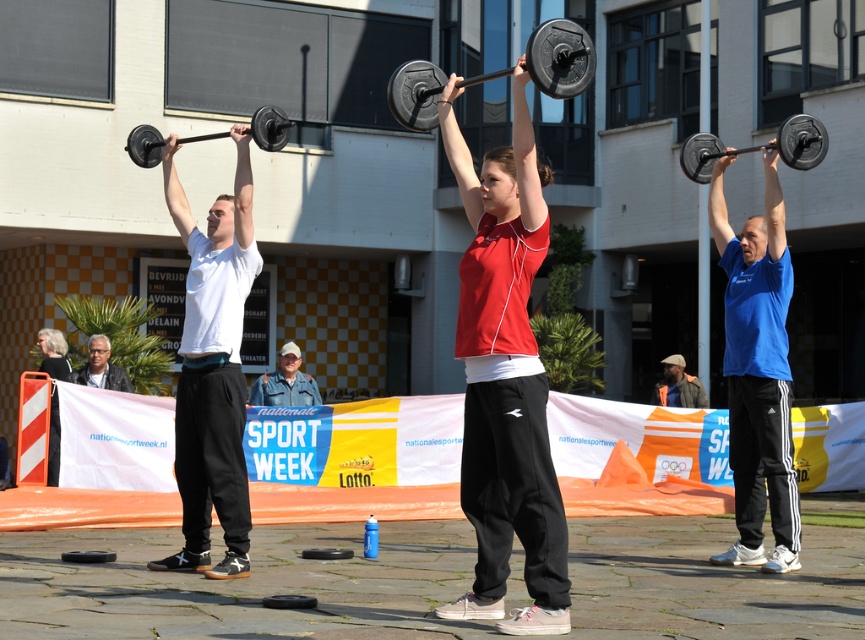
You are standing at the point with coordinates point (88,352) and want to move towards the point with coordinates point (785,314). Which direction should you move?

You should move forward because point (785,314) is in front of point (88,352).

You are a photographer standing at the camera position. You need to place a small sticker on the point closer to you between the two points labeled as point (x=293, y=349) and point (x=87, y=356). Which point should you choose?

You should choose point (x=293, y=349) because it is closer to the camera than point (x=87, y=356).

You are a photographer standing behind the individuals at the weightlifting event. You want to capture a clear photo of the gray hair at center without the khaki fabric cap at center blocking it. Is this possible?

The gray hair at center is behind the khaki fabric cap at center, so it is blocked by the cap. Therefore, you cannot capture a clear photo of the gray hair at center without the khaki fabric cap at center blocking it.